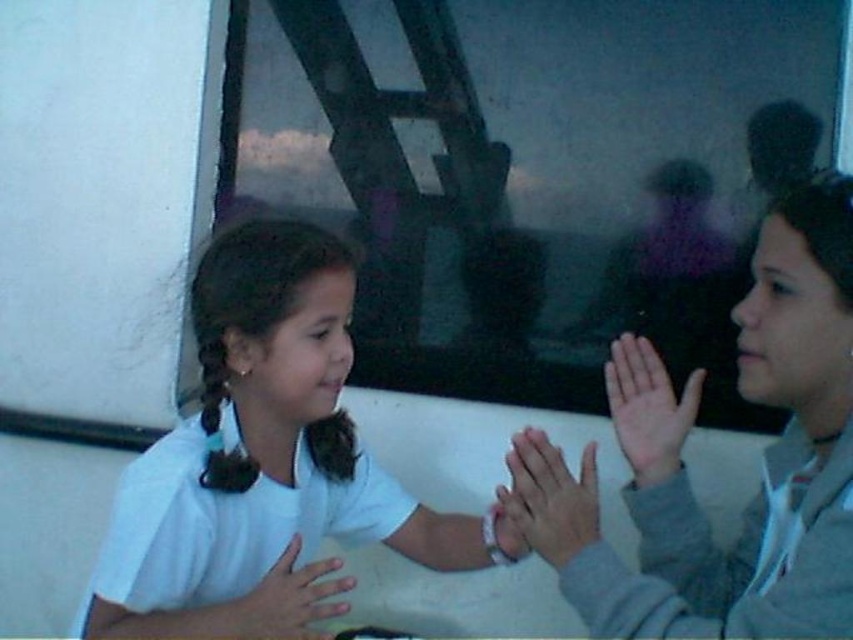
You are standing in a bus station and see two points marked in the image. The first point is at coordinate point (532, 540) and the second is at point (665, 397). Which point is closer to you?

Point (532, 540) is in front of point (665, 397), so it is closer to you.

You are a photographer trying to capture the perfect shot of the two people clapping. You want to ensure that the person with the smooth skin hands at center is positioned to the left of the smooth skin hand at center in the final photo. Based on the scene description, will this positioning already be correct as shown in the image?

Yes, the positioning is already correct because the smooth skin hands at center is to the left of the smooth skin hand at center as described.